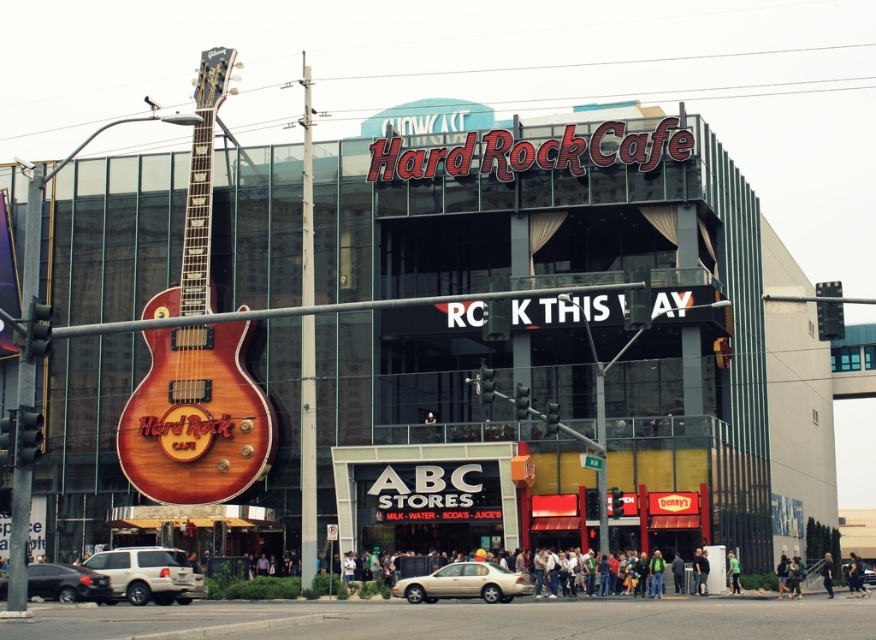
You are a delivery driver who needs to park your beige matte sedan at center in a parking spot that requires vehicles to be no taller than 1.8 meters. Given the wooden guitar at left is much taller than your car, can you safely park your vehicle in this spot?

The wooden guitar at left is much taller than the beige matte sedan at center, but since the parking height restriction is 1.8 meters and the guitar is taller, it doesn not provide information about the car height. You need to measure your car to confirm.

You are a delivery driver who needs to park your beige matte sedan at center as close as possible to the wooden guitar at left. According to the scene, how far apart are these two objects?

The wooden guitar at left is 92.57 feet away from the beige matte sedan at center, so the closest possible distance is 92.57 feet.